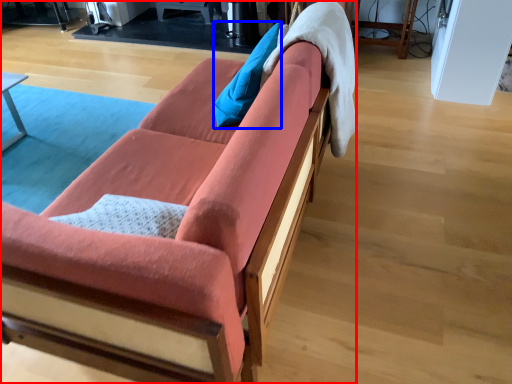
Question: Which object is further to the camera taking this photo, studio couch (highlighted by a red box) or pillow (highlighted by a blue box)?

Choices:
 (A) studio couch
 (B) pillow

Answer: (B)